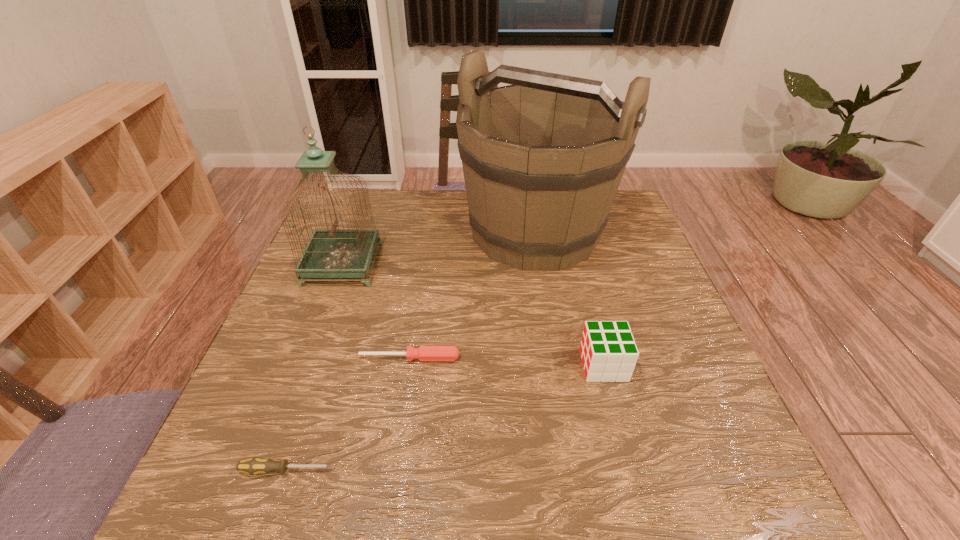
Locate an element on the screen. This screenshot has height=540, width=960. free space located on the back of the farther screwdriver is located at coordinates (425, 252).

Image resolution: width=960 pixels, height=540 pixels. In order to click on free region located 0.280m at the tip of the nearer screwdriver in this screenshot , I will do `click(494, 470)`.

Identify the location of object situated at the far edge. (543, 158).

Locate an element on the screen. object located at the near edge is located at coordinates (253, 466).

I want to click on birdcage present at the left edge, so click(x=330, y=253).

Identify the location of screwdriver that is at the left edge. Image resolution: width=960 pixels, height=540 pixels. (253, 466).

The image size is (960, 540). In order to click on object present at the right edge in this screenshot , I will do `click(543, 158)`.

Where is `object that is at the near left corner`? This screenshot has width=960, height=540. object that is at the near left corner is located at coordinates (253, 466).

Identify the location of object that is at the far right corner. This screenshot has width=960, height=540. (543, 158).

Find the location of a particular element. This screenshot has width=960, height=540. free space at the far edge of the desktop is located at coordinates pos(450,211).